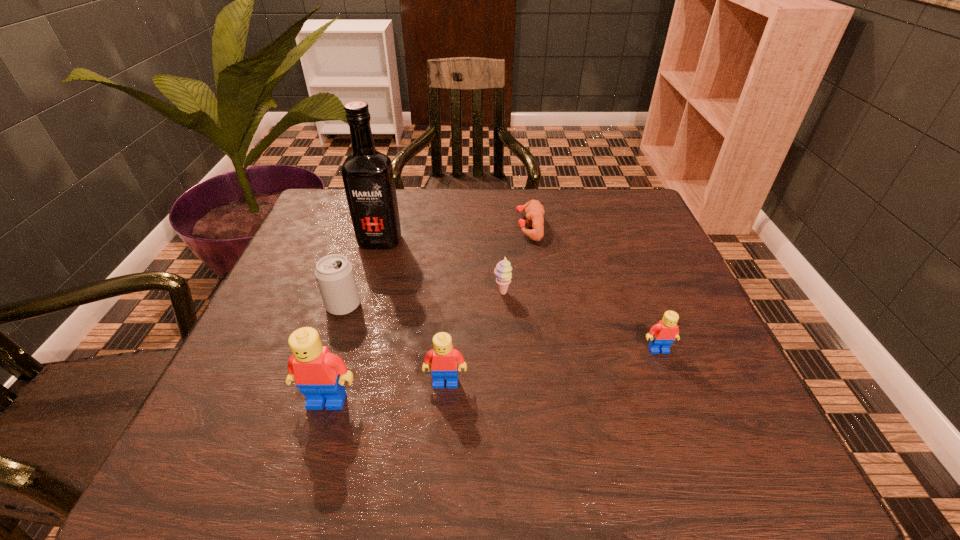
In the image, there is a desktop. Identify the location of vacant space at the far right corner. (588, 192).

Identify the location of vacant point located between the can and the second Lego from left to right. The height and width of the screenshot is (540, 960). (395, 344).

Locate an element on the screen. vacant area between the second nearest object and the puncher is located at coordinates (488, 305).

Locate an element on the screen. free space between the can and the rightmost object is located at coordinates (501, 327).

Locate an element on the screen. empty location between the second nearest Lego and the liquor is located at coordinates (413, 312).

The height and width of the screenshot is (540, 960). Find the location of `empty space between the can and the second tallest object`. empty space between the can and the second tallest object is located at coordinates (335, 353).

Where is `vacant area that lies between the second tallest Lego and the sherbert`? The width and height of the screenshot is (960, 540). vacant area that lies between the second tallest Lego and the sherbert is located at coordinates (474, 338).

Locate an element on the screen. free space between the shortest Lego and the can is located at coordinates (501, 327).

The height and width of the screenshot is (540, 960). What are the coordinates of `vacant space that is in between the sherbert and the rightmost Lego` in the screenshot? It's located at (580, 321).

Identify the location of vacant space that is in between the rightmost object and the tallest Lego. The height and width of the screenshot is (540, 960). (492, 375).